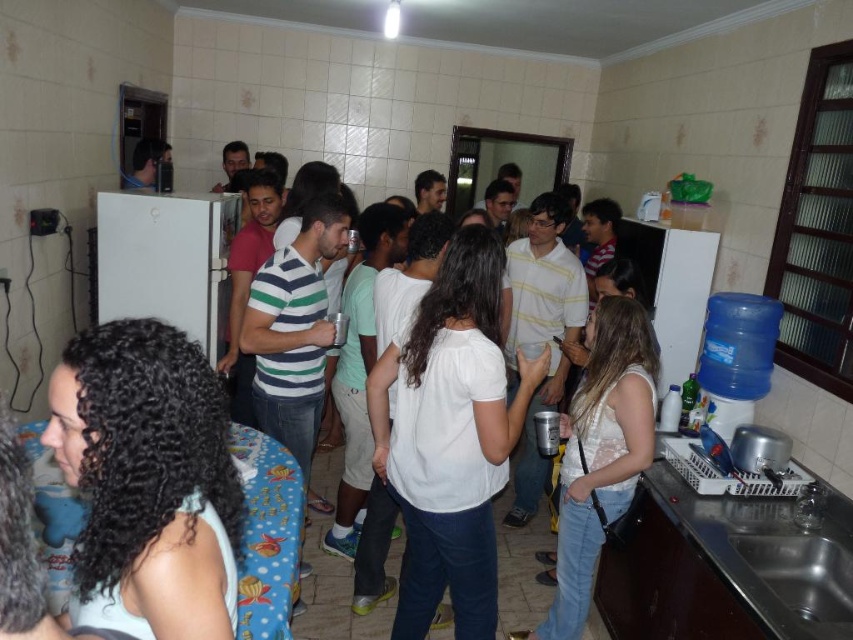
You are standing in the communal kitchen and want to find the woman with curly hair at center. Based on the coordinates provided, in which direction should you look relative to the center of the image?

The curly hair at center is located at coordinates point (148,481). Since the x coordinate is greater than 0.5, it is to the right of the center, and the y coordinate is less than 0.5, so it is below the center. Therefore, you should look to the right and downward from the center of the image to find the woman with curly hair at center.